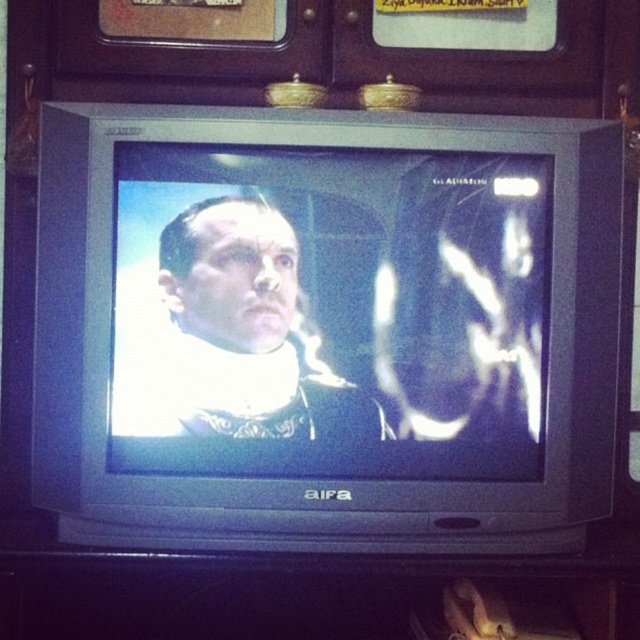
Question: Which point is farther to the camera?

Choices:
 (A) (193, 172)
 (B) (264, 205)

Answer: (B)

Question: Observing the image, what is the correct spatial positioning of matte black television at center in reference to matte black man at center?

Choices:
 (A) left
 (B) right

Answer: (B)

Question: Is matte black television at center thinner than matte black man at center?

Choices:
 (A) yes
 (B) no

Answer: (B)

Question: Is matte black television at center further to the viewer compared to matte black man at center?

Choices:
 (A) no
 (B) yes

Answer: (A)

Question: Which of the following is the farthest from the observer?

Choices:
 (A) click(212, 276)
 (B) click(472, 381)

Answer: (B)